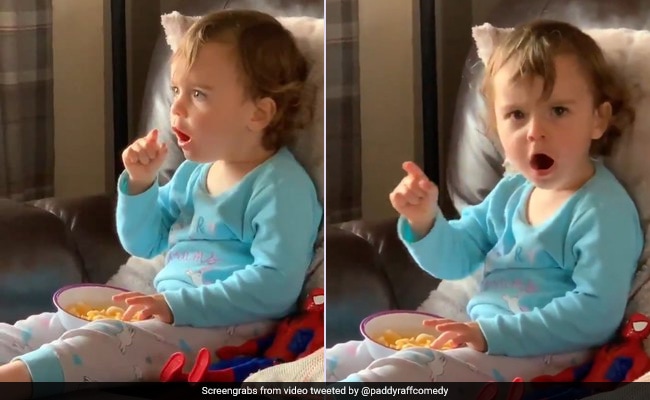
Find the location of a particular element. wall is located at coordinates (395, 87), (88, 40).